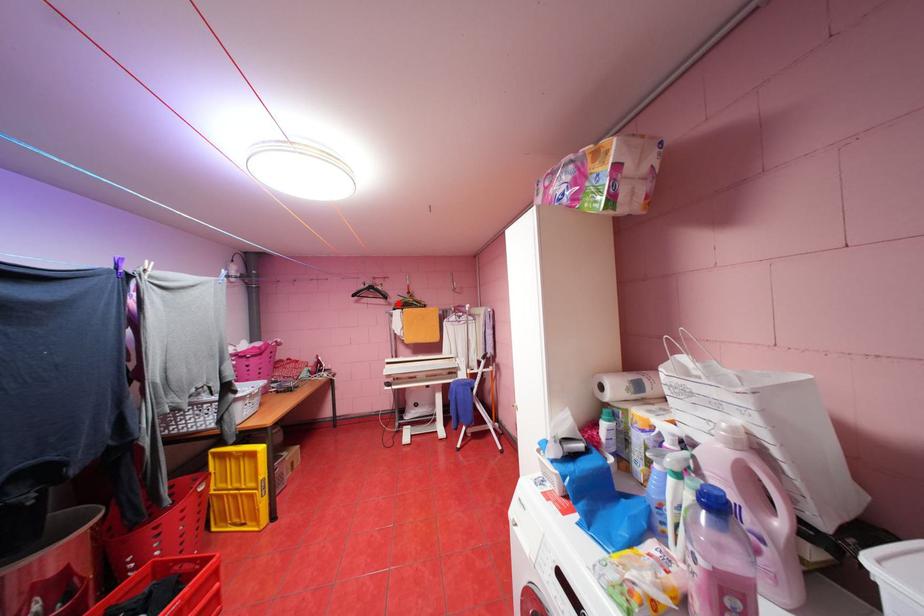
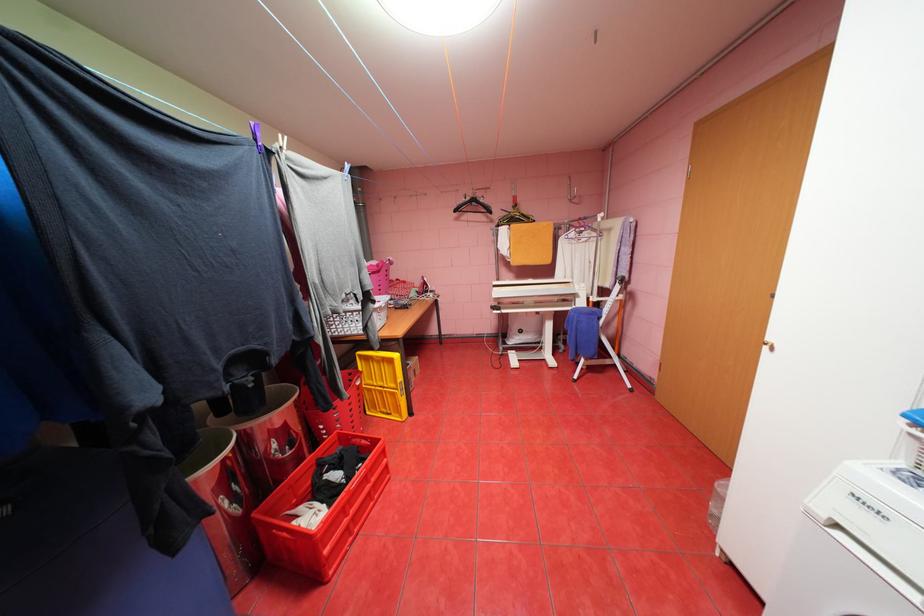
The point at the highlighted location is marked in the first image. Where is the corresponding point in the second image?

(500, 221)